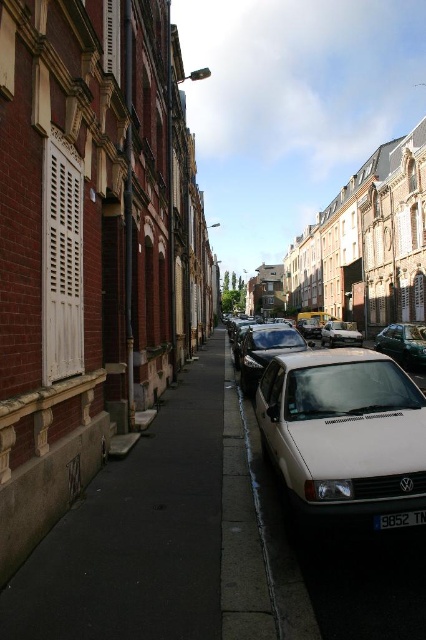
Consider the image. You are a delivery driver navigating a narrow urban street. You need to park your white matte car at center in a spot that is not occupied. Based on the scene, where should you park your car?

The white matte car at center is located at point (344, 433), so you should park it there as it is not occupied by any other vehicle.

Consider the image. You are a delivery driver trying to park your van in the narrow urban street. You see the white matte car at center and the silver metallic van at center. Which vehicle should you avoid parking behind to ensure you can exit easily?

You should avoid parking behind the white matte car at center because it is located below the silver metallic van at center, meaning the van is positioned higher and might block your exit.